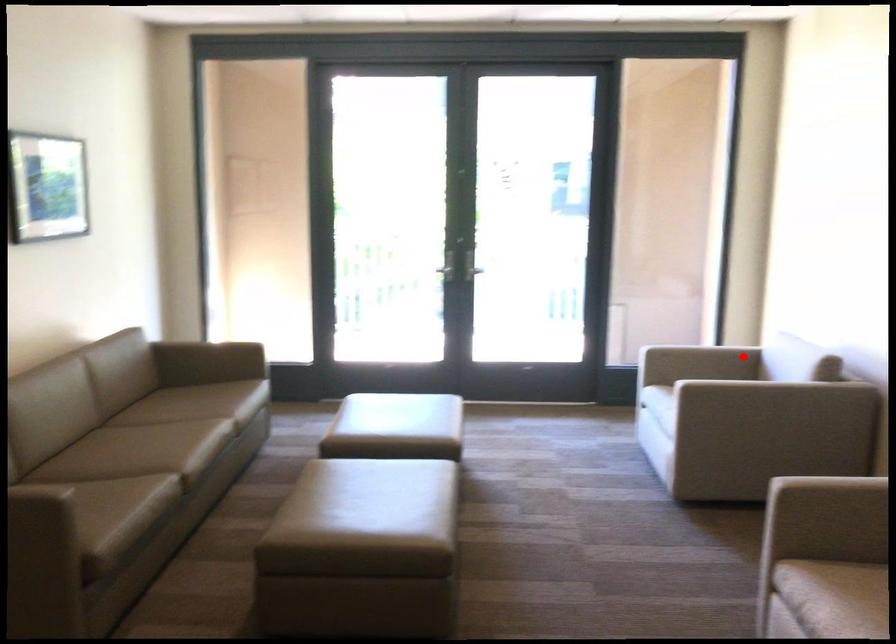
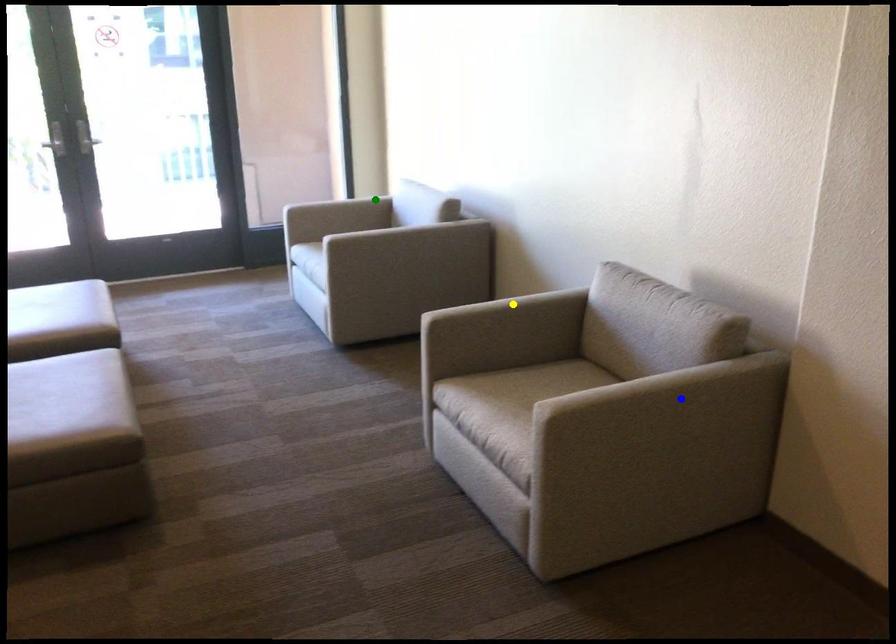
Question: I am providing you with two images of the same scene from different viewpoints. A red point is marked on the first image. You are given multiple points on the second image. Which spot in image 2 lines up with the point in image 1?

Choices:
 (A) yellow point
 (B) blue point
 (C) green point

Answer: (C)